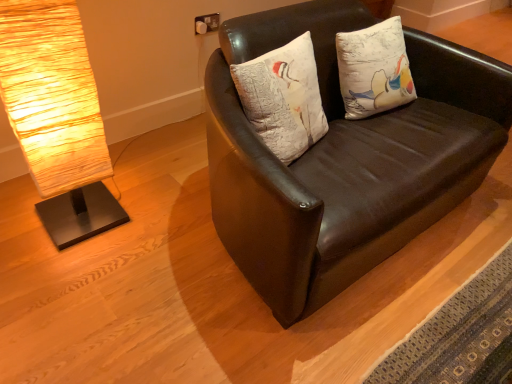
Question: From the image's perspective, does matte brown leather couch at center appear lower than white textured pillow at center?

Choices:
 (A) no
 (B) yes

Answer: (B)

Question: Considering the relative sizes of matte brown leather couch at center and white textured pillow at center in the image provided, is matte brown leather couch at center bigger than white textured pillow at center?

Choices:
 (A) yes
 (B) no

Answer: (A)

Question: Is matte brown leather couch at center in contact with white textured pillow at center?

Choices:
 (A) yes
 (B) no

Answer: (B)

Question: Is matte brown leather couch at center in front of white textured pillow at center?

Choices:
 (A) no
 (B) yes

Answer: (B)

Question: Is matte brown leather couch at center to the right of white textured pillow at center from the viewer's perspective?

Choices:
 (A) yes
 (B) no

Answer: (A)

Question: Is matte brown leather couch at center shorter than white textured pillow at center?

Choices:
 (A) yes
 (B) no

Answer: (B)

Question: Is matte brown leather couch at center shorter than rustic wood lamp at left?

Choices:
 (A) yes
 (B) no

Answer: (A)

Question: Is matte brown leather couch at center to the left of rustic wood lamp at left from the viewer's perspective?

Choices:
 (A) no
 (B) yes

Answer: (A)

Question: Does matte brown leather couch at center have a larger size compared to rustic wood lamp at left?

Choices:
 (A) yes
 (B) no

Answer: (A)

Question: From the image's perspective, is matte brown leather couch at center over rustic wood lamp at left?

Choices:
 (A) yes
 (B) no

Answer: (A)

Question: Does matte brown leather couch at center have a lesser width compared to rustic wood lamp at left?

Choices:
 (A) yes
 (B) no

Answer: (B)

Question: Is matte brown leather couch at center beside rustic wood lamp at left?

Choices:
 (A) no
 (B) yes

Answer: (A)

Question: Is rustic wood lamp at left not close to white textured pillow at center?

Choices:
 (A) no
 (B) yes

Answer: (A)